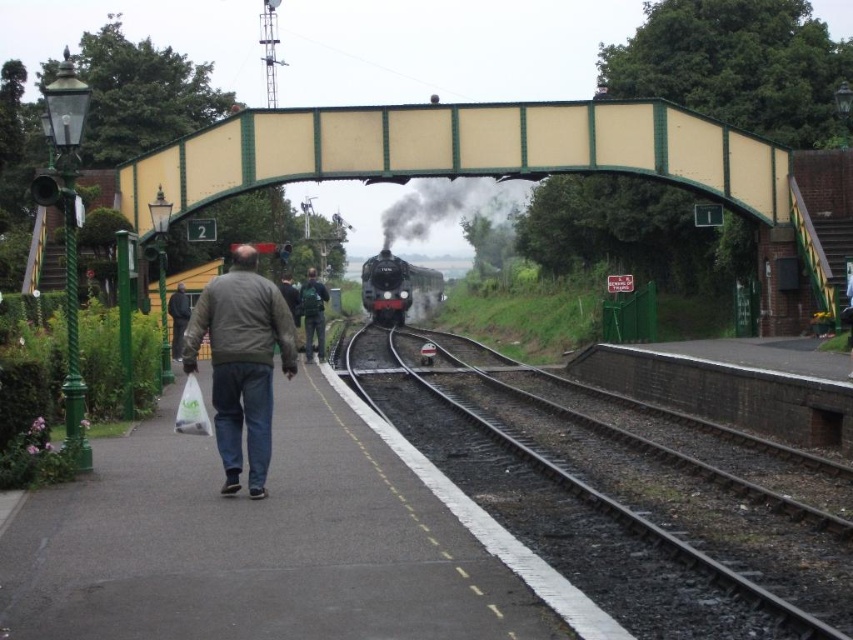
Question: Can you confirm if dark gray jacket at center is thinner than polished black locomotive at center?

Choices:
 (A) no
 (B) yes

Answer: (B)

Question: Which object is positioned farthest from the dark gray jacket at center?

Choices:
 (A) black metallic steam at center
 (B) yellow painted metal bridge at center
 (C) dark green backpack at center

Answer: (A)

Question: Observing the image, what is the correct spatial positioning of yellow painted metal bridge at center in reference to polished black locomotive at center?

Choices:
 (A) below
 (B) above

Answer: (B)

Question: Which point is closer to the camera?

Choices:
 (A) (306, 305)
 (B) (374, 298)
 (C) (219, 321)
 (D) (515, 196)

Answer: (C)

Question: Is polished black locomotive at center bigger than dark green backpack at center?

Choices:
 (A) no
 (B) yes

Answer: (A)

Question: Which object is positioned closest to the dark gray jacket at center?

Choices:
 (A) polished black locomotive at center
 (B) yellow painted metal bridge at center
 (C) black metal train track at lower center
 (D) black metallic steam at center

Answer: (C)